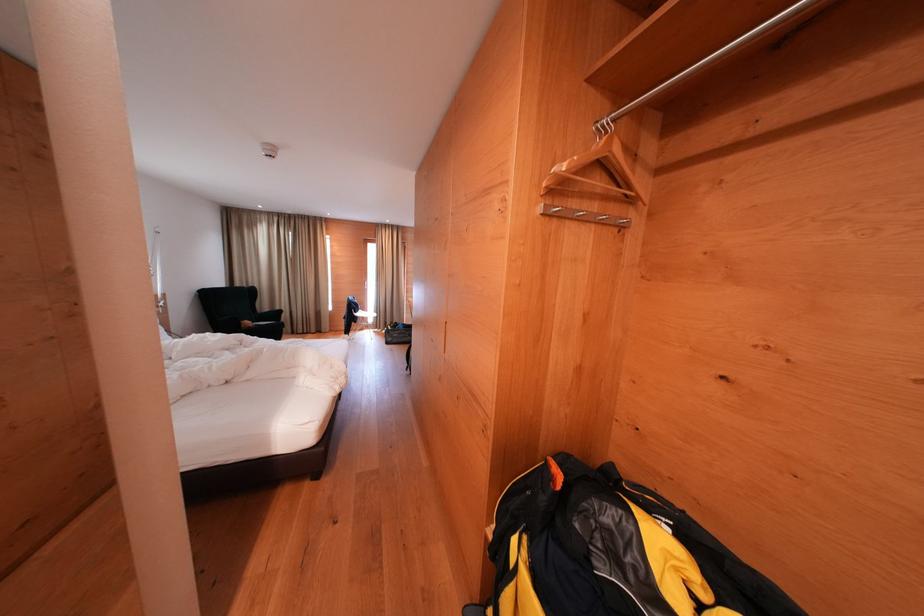
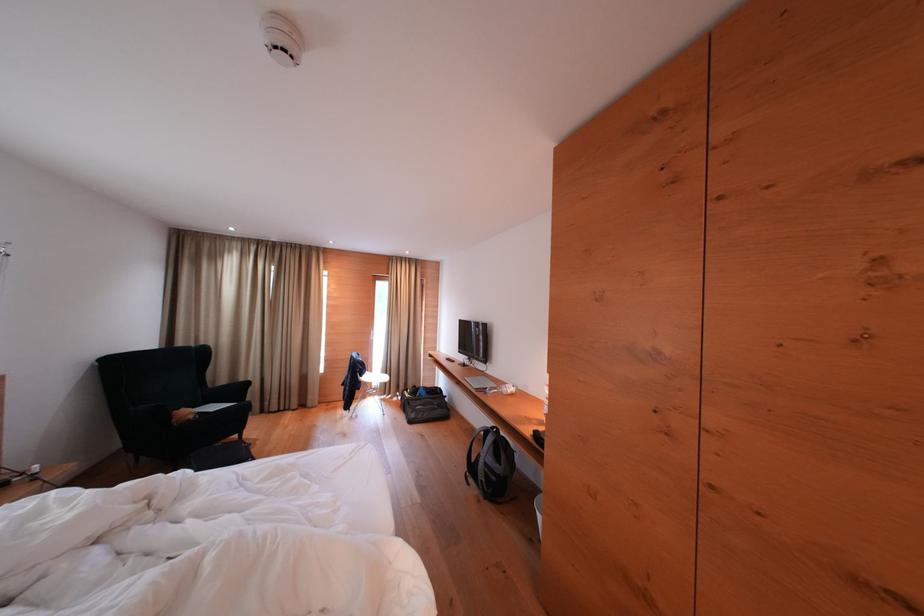
Find the pixel in the second image that matches pixel 374 318 in the first image.

(383, 379)